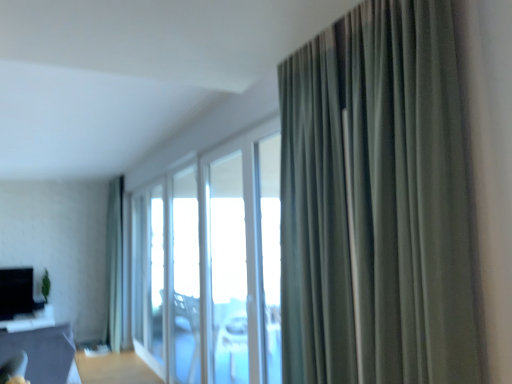
What do you see at coordinates (156, 275) in the screenshot?
I see `transparent glass window screen at center` at bounding box center [156, 275].

Measure the distance between transparent glass window screen at center and camera.

The depth of transparent glass window screen at center is 4.94 meters.

The image size is (512, 384). I want to click on matte gray table at lower left, so click(44, 353).

What do you see at coordinates (410, 194) in the screenshot? Image resolution: width=512 pixels, height=384 pixels. I see `green fabric curtain at right, the first curtain viewed from the right` at bounding box center [410, 194].

Locate an element on the screen. transparent glass window at center, the 2th window positioned from the front is located at coordinates (228, 270).

The height and width of the screenshot is (384, 512). What do you see at coordinates (149, 276) in the screenshot? I see `white glass screen door at center` at bounding box center [149, 276].

Locate an element on the screen. The image size is (512, 384). clear glass window at center, arranged as the 1th window when viewed from the front is located at coordinates (211, 265).

What are the coordinates of `transparent glass window screen at center` in the screenshot? It's located at (156, 275).

Considering the relative sizes of green fabric curtain at left, the second curtain in the right-to-left sequence, and transparent glass window screen at center in the image provided, is green fabric curtain at left, the second curtain in the right-to-left sequence, bigger than transparent glass window screen at center?

Correct, green fabric curtain at left, the second curtain in the right-to-left sequence, is larger in size than transparent glass window screen at center.

Is green fabric curtain at left, which appears as the first curtain when viewed from the left, positioned before transparent glass window screen at center?

No, it is behind transparent glass window screen at center.

The image size is (512, 384). I want to click on window screen directly beneath the green fabric curtain at left, which ranks as the 2th curtain in front-to-back order (from a real-world perspective), so click(156, 275).

Could you measure the distance between green fabric curtain at left, which appears as the first curtain when viewed from the left, and transparent glass window screen at center?

1.14 meters.

Which point is more distant from viewer, (159, 367) or (29, 360)?

The point (159, 367) is farther.

Is white glass screen door at center in front of matte gray table at lower left?

No.

Is white glass screen door at center taller or shorter than matte gray table at lower left?

white glass screen door at center is taller than matte gray table at lower left.

Can you confirm if white glass screen door at center is smaller than matte gray table at lower left?

Yes.

Which object is more forward, green fabric curtain at right, the first curtain viewed from the right, or transparent glass window at center, the 2th window positioned from the front?

Positioned in front is green fabric curtain at right, the first curtain viewed from the right.

Based on the photo, could you tell me if green fabric curtain at right, positioned as the 2th curtain in back-to-front order, is facing transparent glass window at center, the 2th window positioned from the front?

No, green fabric curtain at right, positioned as the 2th curtain in back-to-front order, is not facing towards transparent glass window at center, the 2th window positioned from the front.

Identify the location of the 2nd window below the green fabric curtain at right, which is counted as the second curtain, starting from the left (from a real-world perspective). The height and width of the screenshot is (384, 512). (228, 270).

Does point (122, 176) come closer to viewer compared to point (238, 287)?

No, it is behind (238, 287).

From a real-world perspective, who is located lower, green fabric curtain at left, which ranks as the 2th curtain in front-to-back order, or transparent glass window at center, arranged as the 2th window when viewed from the back?

green fabric curtain at left, which ranks as the 2th curtain in front-to-back order, from a real-world perspective.

Which of these two, green fabric curtain at left, the second curtain in the right-to-left sequence, or transparent glass window at center, the 2th window positioned from the front, stands taller?

green fabric curtain at left, the second curtain in the right-to-left sequence.

Does green fabric curtain at right, the first curtain viewed from the right, have a lesser height compared to transparent glass window at center, the 3th window when ordered from front to back?

Indeed, green fabric curtain at right, the first curtain viewed from the right, has a lesser height compared to transparent glass window at center, the 3th window when ordered from front to back.

What's the angular difference between green fabric curtain at right, positioned as the 2th curtain in back-to-front order, and transparent glass window at center, which is counted as the 1th window, starting from the back,'s facing directions?

They differ by 1.12 degrees in their facing directions.

From a real-world perspective, does green fabric curtain at right, marked as the first curtain in a front-to-back arrangement, sit lower than transparent glass window at center, which is counted as the 1th window, starting from the back?

No, from a real-world perspective, green fabric curtain at right, marked as the first curtain in a front-to-back arrangement, is not below transparent glass window at center, which is counted as the 1th window, starting from the back.

From the image's perspective, is white glass screen door at center beneath transparent glass window at center, which is counted as the 1th window, starting from the back?

Correct, white glass screen door at center appears lower than transparent glass window at center, which is counted as the 1th window, starting from the back, in the image.

Looking at this image, is white glass screen door at center positioned far away from transparent glass window at center, the 3th window when ordered from front to back?

No.

Is white glass screen door at center oriented away from transparent glass window at center, which is counted as the 1th window, starting from the back?

No, white glass screen door at center is not facing the opposite direction of transparent glass window at center, which is counted as the 1th window, starting from the back.

Which object is positioned more to the right, white glass screen door at center or transparent glass window at center, which is counted as the 1th window, starting from the back?

From the viewer's perspective, transparent glass window at center, which is counted as the 1th window, starting from the back, appears more on the right side.

Considering the sizes of green fabric curtain at left, which appears as the first curtain when viewed from the left, and clear glass window at center, which ranks as the third window in back-to-front order, in the image, is green fabric curtain at left, which appears as the first curtain when viewed from the left, bigger or smaller than clear glass window at center, which ranks as the third window in back-to-front order,?

Clearly, green fabric curtain at left, which appears as the first curtain when viewed from the left, is larger in size than clear glass window at center, which ranks as the third window in back-to-front order.

Is green fabric curtain at left, which is the first curtain from back to front, not close to clear glass window at center, which ranks as the third window in back-to-front order?

green fabric curtain at left, which is the first curtain from back to front, is far away from clear glass window at center, which ranks as the third window in back-to-front order.

Who is more distant, green fabric curtain at left, which is the first curtain from back to front, or clear glass window at center, which ranks as the third window in back-to-front order?

green fabric curtain at left, which is the first curtain from back to front.

Does green fabric curtain at left, the second curtain in the right-to-left sequence, have a greater width compared to clear glass window at center, which ranks as the third window in back-to-front order?

Yes, green fabric curtain at left, the second curtain in the right-to-left sequence, is wider than clear glass window at center, which ranks as the third window in back-to-front order.

This screenshot has height=384, width=512. I want to click on window screen located underneath the green fabric curtain at left, which is the first curtain from back to front (from a real-world perspective), so click(x=156, y=275).

Locate an element on the screen. screen door that is above the matte gray table at lower left (from a real-world perspective) is located at coordinates (149, 276).

Looking at this image, looking at the image, which one is located closer to green fabric curtain at right, marked as the first curtain in a front-to-back arrangement, transparent glass window at center, arranged as the 2th window when viewed from the back, or clear glass window at center, which ranks as the third window in back-to-front order?

clear glass window at center, which ranks as the third window in back-to-front order, is closer to green fabric curtain at right, marked as the first curtain in a front-to-back arrangement.

Based on their spatial positions, is clear glass window at center, arranged as the 1th window when viewed from the front, or transparent glass window at center, which is counted as the 1th window, starting from the back, further from transparent glass window at center, the 2th window positioned from the front?

transparent glass window at center, which is counted as the 1th window, starting from the back.

Considering their positions, is matte gray table at lower left positioned closer to clear glass window at center, arranged as the 1th window when viewed from the front, than transparent glass window screen at center?

Among the two, transparent glass window screen at center is located nearer to clear glass window at center, arranged as the 1th window when viewed from the front.

Considering their positions, is transparent glass window screen at center positioned closer to green fabric curtain at right, the first curtain viewed from the right, than green fabric curtain at left, which ranks as the 2th curtain in front-to-back order?

transparent glass window screen at center is closer to green fabric curtain at right, the first curtain viewed from the right.

When comparing their distances from white glass screen door at center, does transparent glass window at center, the 2th window positioned from the front, or matte gray table at lower left seem further?

transparent glass window at center, the 2th window positioned from the front, is further to white glass screen door at center.

Estimate the real-world distances between objects in this image. Which object is further from white glass screen door at center, transparent glass window at center, the 2th window positioned from the front, or green fabric curtain at left, which appears as the first curtain when viewed from the left?

transparent glass window at center, the 2th window positioned from the front, lies further to white glass screen door at center than the other object.

From the image, which object appears to be nearer to transparent glass window at center, which is counted as the 1th window, starting from the back, green fabric curtain at left, which is the first curtain from back to front, or transparent glass window screen at center?

Based on the image, transparent glass window screen at center appears to be nearer to transparent glass window at center, which is counted as the 1th window, starting from the back.

Which object lies nearer to the anchor point clear glass window at center, arranged as the 1th window when viewed from the front, transparent glass window at center, which is counted as the 1th window, starting from the back, or transparent glass window at center, arranged as the 2th window when viewed from the back?

transparent glass window at center, which is counted as the 1th window, starting from the back.

Locate an element on the screen. The image size is (512, 384). window screen between clear glass window at center, which ranks as the third window in back-to-front order, and green fabric curtain at left, which is the first curtain from back to front, from front to back is located at coordinates (156, 275).

You are a GUI agent. You are given a task and a screenshot of the screen. Output one action in this format:
    pyautogui.click(x=<x>, y=<y>)
    Task: Click on the window screen between matte gray table at lower left and transparent glass window at center, the 2th window positioned from the front, in the horizontal direction
    The height and width of the screenshot is (384, 512).
    Given the screenshot: What is the action you would take?
    [x=156, y=275]

Identify the location of screen door located between matte gray table at lower left and transparent glass window at center, arranged as the 2th window when viewed from the back, in the left-right direction. This screenshot has width=512, height=384. (149, 276).

Locate an element on the screen. Image resolution: width=512 pixels, height=384 pixels. window located between green fabric curtain at right, the first curtain viewed from the right, and transparent glass window at center, the 2th window positioned from the front, in the depth direction is located at coordinates pyautogui.click(x=211, y=265).